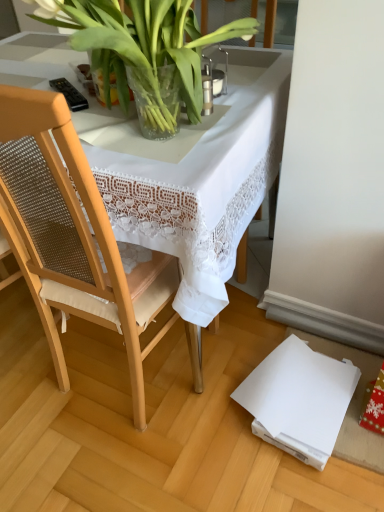
You are a GUI agent. You are given a task and a screenshot of the screen. Output one action in this format:
    pyautogui.click(x=<x>, y=<y>)
    Task: Click on the vacant area located to the right-hand side of wooden chair at left
    
    Given the screenshot: What is the action you would take?
    pyautogui.click(x=231, y=352)